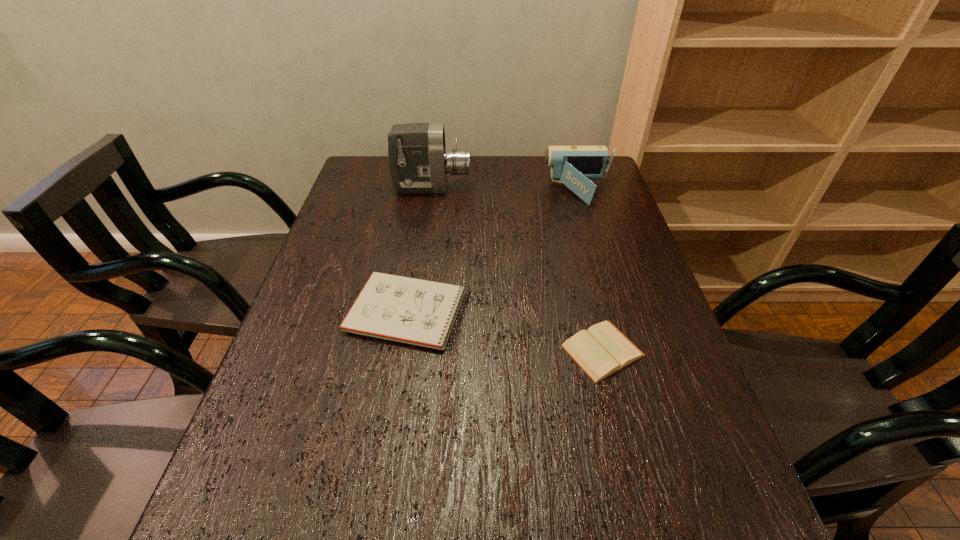
The image size is (960, 540). Find the location of `free space at the right edge of the desktop`. free space at the right edge of the desktop is located at coordinates (580, 217).

The height and width of the screenshot is (540, 960). I want to click on empty location between the left camcorder and the shortest object, so click(517, 269).

This screenshot has width=960, height=540. What are the coordinates of `free area in between the notepad and the shortest object` in the screenshot? It's located at pyautogui.click(x=506, y=331).

Find the location of a particular element. free area in between the notepad and the shortest object is located at coordinates (506, 331).

Locate an element on the screen. This screenshot has height=540, width=960. unoccupied position between the diary and the left camcorder is located at coordinates (517, 269).

Where is `free spot between the notepad and the third shortest object`? The width and height of the screenshot is (960, 540). free spot between the notepad and the third shortest object is located at coordinates (494, 252).

Find the location of a particular element. The width and height of the screenshot is (960, 540). free space between the third shortest object and the second shortest object is located at coordinates click(494, 252).

At what (x,y) coordinates should I click in order to perform the action: click on vacant point located between the shortest object and the second shortest object. Please return your answer as a coordinate pair (x, y). Looking at the image, I should click on (506, 331).

Where is `free area in between the shortest object and the third shortest object`? This screenshot has height=540, width=960. free area in between the shortest object and the third shortest object is located at coordinates (590, 271).

Identify the location of vacant point located between the notepad and the shortest object. (506, 331).